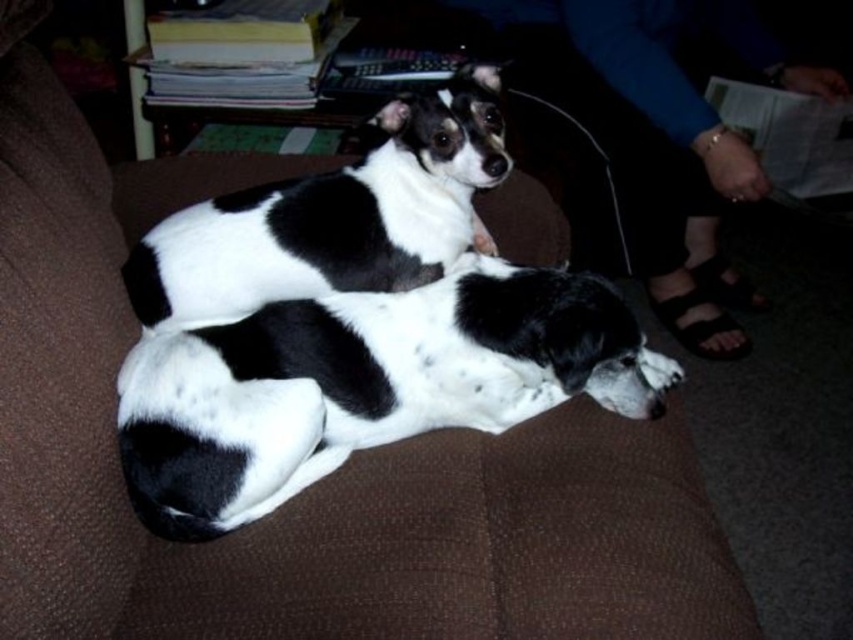
Question: Can you confirm if black and white fur at center is positioned to the right of black and white fur dog at center?

Choices:
 (A) yes
 (B) no

Answer: (A)

Question: Which point is closer to the camera taking this photo?

Choices:
 (A) (288, 230)
 (B) (540, 300)

Answer: (B)

Question: Which point is closer to the camera taking this photo?

Choices:
 (A) (195, 488)
 (B) (431, 145)

Answer: (A)

Question: Is black and white fur at center positioned in front of black and white fur dog at center?

Choices:
 (A) yes
 (B) no

Answer: (A)

Question: Does black and white fur at center have a lesser width compared to black and white fur dog at center?

Choices:
 (A) yes
 (B) no

Answer: (B)

Question: Which point is farther to the camera?

Choices:
 (A) (495, 360)
 (B) (483, 166)

Answer: (A)